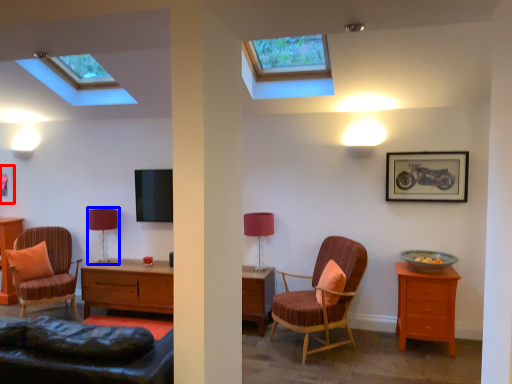
Question: Which of the following is the farthest to the observer, picture frame (highlighted by a red box) or table lamp (highlighted by a blue box)?

Choices:
 (A) picture frame
 (B) table lamp

Answer: (A)